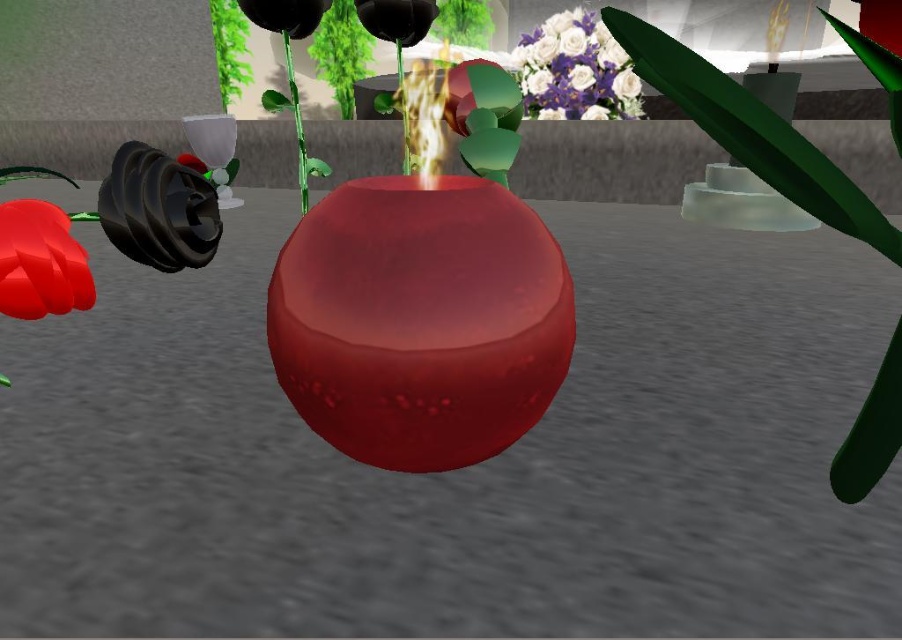
Question: Which point appears closest to the camera in this image?

Choices:
 (A) (621, 116)
 (B) (58, 234)

Answer: (B)

Question: Where is glossy ceramic vase at upper center located in relation to matte red flower at lower left in the image?

Choices:
 (A) above
 (B) below

Answer: (A)

Question: Is glossy ceramic vase at upper center positioned at the back of matte red flower at lower left?

Choices:
 (A) no
 (B) yes

Answer: (B)

Question: Is glossy ceramic vase at upper center smaller than matte red flower at lower left?

Choices:
 (A) no
 (B) yes

Answer: (A)